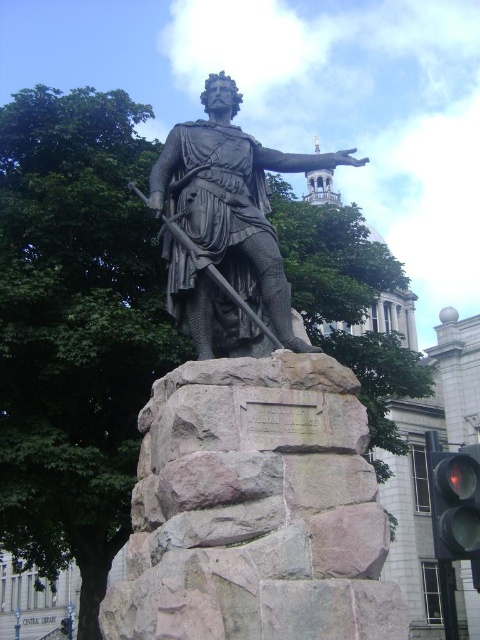
Between polished bronze statue at center and bronze statue at center, which one has more height?

polished bronze statue at center

Is polished bronze statue at center taller than bronze statue at center?

Yes.

The width and height of the screenshot is (480, 640). Describe the element at coordinates (247, 429) in the screenshot. I see `polished bronze statue at center` at that location.

I want to click on polished bronze statue at center, so click(247, 429).

Is the position of bronze statue at center more distant than that of red glass traffic light at lower right?

No, bronze statue at center is in front of red glass traffic light at lower right.

The image size is (480, 640). Identify the location of bronze statue at center. (232, 200).

This screenshot has height=640, width=480. I want to click on bronze statue at center, so click(232, 200).

Which is more to the left, polished bronze statue at center or red glass traffic light at lower right?

polished bronze statue at center

Is point (211, 518) in front of point (446, 490)?

Yes, it is.

Between point (256, 243) and point (453, 540), which one is positioned behind?

The point (453, 540) is more distant.

I want to click on polished bronze statue at center, so pyautogui.click(x=247, y=429).